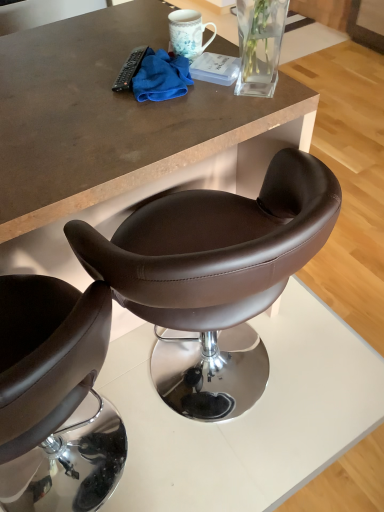
You are a GUI agent. You are given a task and a screenshot of the screen. Output one action in this format:
    pyautogui.click(x=<x>, y=<y>)
    Task: Click on the vacant area that lies to the right of blue microfiber cloth at upper center
    
    Given the screenshot: What is the action you would take?
    pyautogui.click(x=243, y=92)